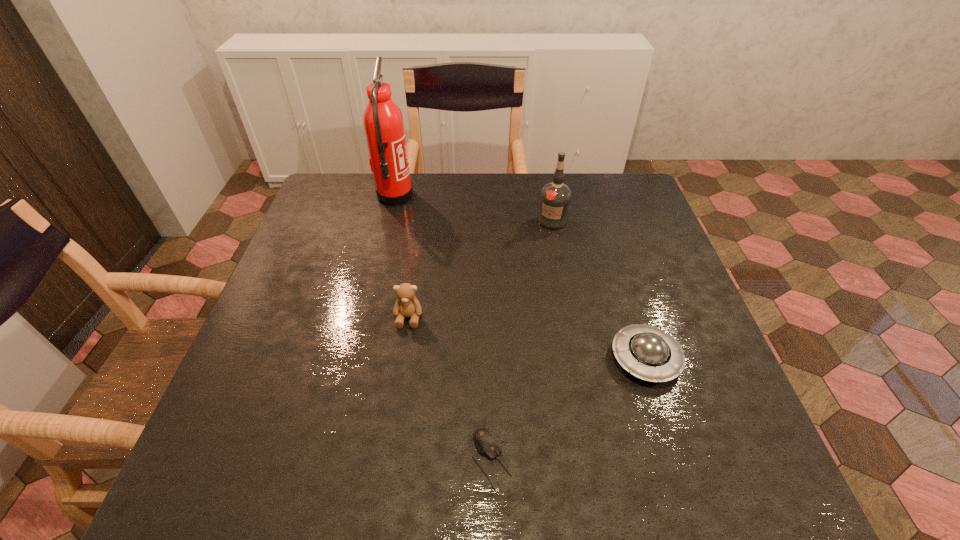
The image size is (960, 540). What are the coordinates of `vacant point located between the third object from right to left and the second farthest object` in the screenshot? It's located at (522, 340).

Locate an element on the screen. The image size is (960, 540). vacant region between the vodka and the teddy bear is located at coordinates (481, 269).

I want to click on unoccupied position between the second object from left to right and the fourth tallest object, so click(x=527, y=338).

The height and width of the screenshot is (540, 960). What are the coordinates of `unoccupied position between the leftmost object and the nearest object` in the screenshot? It's located at point(443,328).

Identify the location of free space between the third farthest object and the second nearest object. This screenshot has width=960, height=540. (527, 338).

Locate an element on the screen. Image resolution: width=960 pixels, height=540 pixels. vacant space that is in between the fourth nearest object and the shortest object is located at coordinates (522, 340).

At what (x,y) coordinates should I click in order to perform the action: click on object that is the second closest to the fire extinguisher. Please return your answer as a coordinate pair (x, y). This screenshot has width=960, height=540. Looking at the image, I should click on (407, 305).

Locate which object ranks third in proximity to the nearest object. Please provide its 2D coordinates. Your answer should be formatted as a tuple, i.e. [(x, y)], where the tuple contains the x and y coordinates of a point satisfying the conditions above.

[(555, 198)]

Locate an element on the screen. The height and width of the screenshot is (540, 960). vacant area that satisfies the following two spatial constraints: 1. on the front-facing side of the third shortest object; 2. on the left side of the shortest object is located at coordinates [x=388, y=460].

You are a GUI agent. You are given a task and a screenshot of the screen. Output one action in this format:
    pyautogui.click(x=<x>, y=<y>)
    Task: Click on the free space in the image that satisfies the following two spatial constraints: 1. on the front label of the vodka; 2. on the left side of the saucer
    
    Given the screenshot: What is the action you would take?
    pyautogui.click(x=578, y=359)